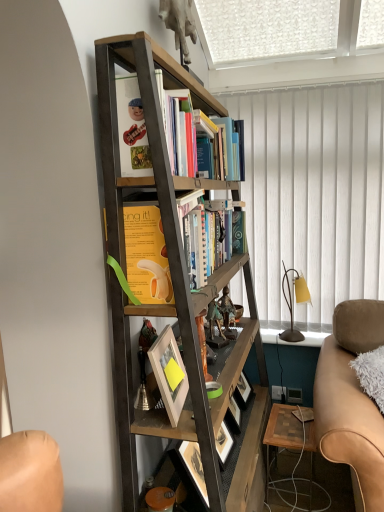
Question: From a real-world perspective, is yellow paperback book at center, the first book viewed from the front, positioned under white matte picture frame at center based on gravity?

Choices:
 (A) no
 (B) yes

Answer: (A)

Question: From a real-world perspective, is yellow paperback book at center, the first book viewed from the front, physically above white matte picture frame at center?

Choices:
 (A) no
 (B) yes

Answer: (B)

Question: Is yellow paperback book at center, the first book viewed from the front, next to white matte picture frame at center?

Choices:
 (A) no
 (B) yes

Answer: (A)

Question: Is the position of yellow paperback book at center, the first book viewed from the front, more distant than that of white matte picture frame at center?

Choices:
 (A) no
 (B) yes

Answer: (A)

Question: Can you confirm if yellow paperback book at center, the first book viewed from the front, is smaller than white matte picture frame at center?

Choices:
 (A) no
 (B) yes

Answer: (A)

Question: Is yellow paperback book at center, the first book viewed from the front, bigger than white matte picture frame at center?

Choices:
 (A) no
 (B) yes

Answer: (B)

Question: Is the position of wooden/matte table at lower right less distant than that of white textured curtain at upper right?

Choices:
 (A) yes
 (B) no

Answer: (A)

Question: Is wooden/matte table at lower right wider than white textured curtain at upper right?

Choices:
 (A) no
 (B) yes

Answer: (B)

Question: Would you say wooden/matte table at lower right is outside white textured curtain at upper right?

Choices:
 (A) no
 (B) yes

Answer: (B)

Question: Is wooden/matte table at lower right facing away from white textured curtain at upper right?

Choices:
 (A) no
 (B) yes

Answer: (A)

Question: From the image's perspective, is wooden/matte table at lower right on white textured curtain at upper right?

Choices:
 (A) yes
 (B) no

Answer: (B)

Question: Is wooden/matte table at lower right touching white textured curtain at upper right?

Choices:
 (A) no
 (B) yes

Answer: (A)

Question: Does white textured curtain at upper right contain metallic figurine at center, arranged as the second toy when viewed from the front?

Choices:
 (A) yes
 (B) no

Answer: (B)